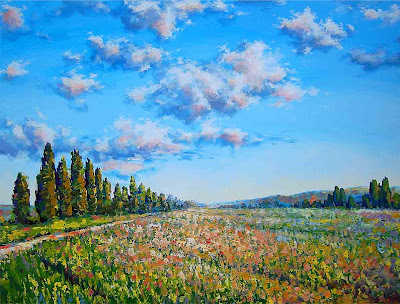
The height and width of the screenshot is (304, 400). What are the coordinates of `art` in the screenshot? It's located at (219, 131).